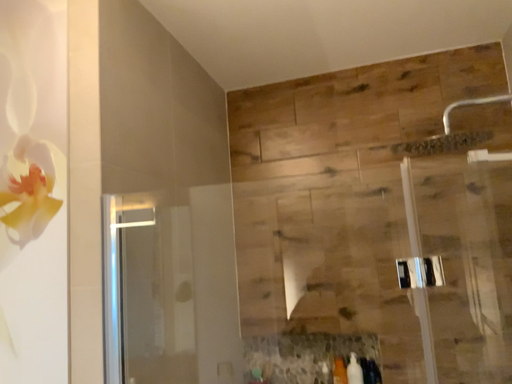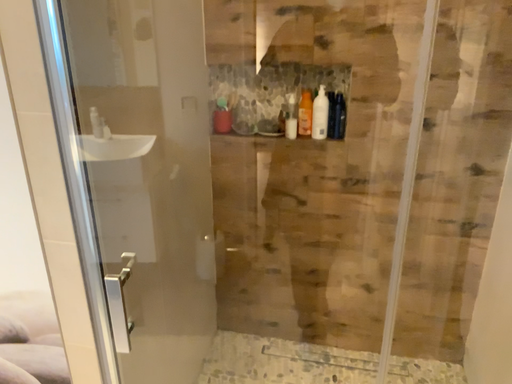
Question: Which way did the camera rotate in the video?

Choices:
 (A) rotated downward
 (B) rotated upward

Answer: (A)